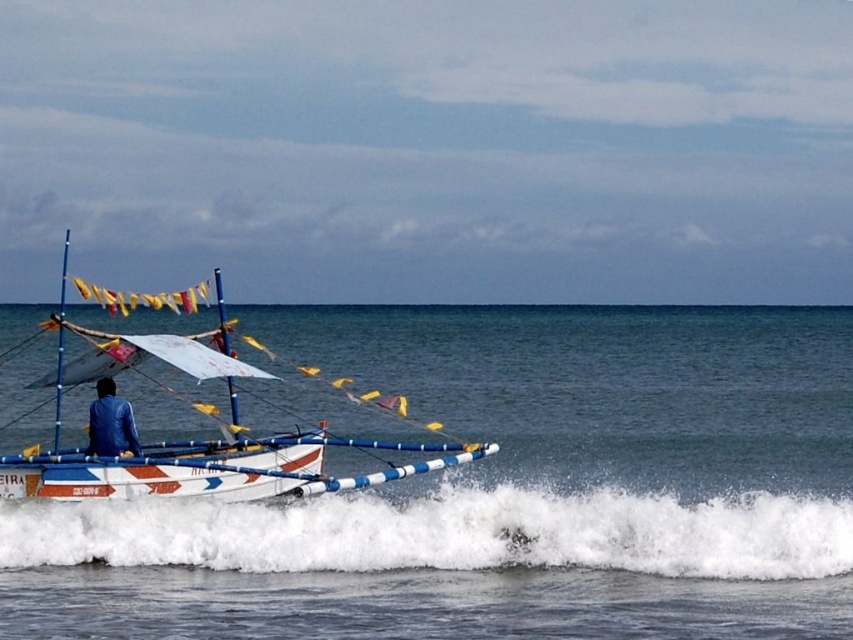
Based on the photo, you are standing on a nearby dock and want to reach the point at coordinates point (x=676, y=524) on the banca boat. If your swimming range is 20 meters, can you safely swim to that point?

The distance of point (x=676, y=524) from viewer is 17.40 meters, so yes, you can safely swim to that point since it is within your 20 meters swimming range.

You are a passenger on the banca and you want to avoid getting splashed by the white frothy wave at lower center. Where should you move to stay dry?

You should move away from the white frothy wave at lower center, which is located at point 0.833 on the x axis and 0.530 on the y axis, to avoid getting splashed.

You are a passenger on the banca and notice the white frothy water at lower center. Based on its position, can you determine if it is in front of or behind the boat?

The white frothy water at lower center is located at point 0.770 on the x and 0.594 on the y, which places it behind the boat since it is closer to the stern where the person is steering.